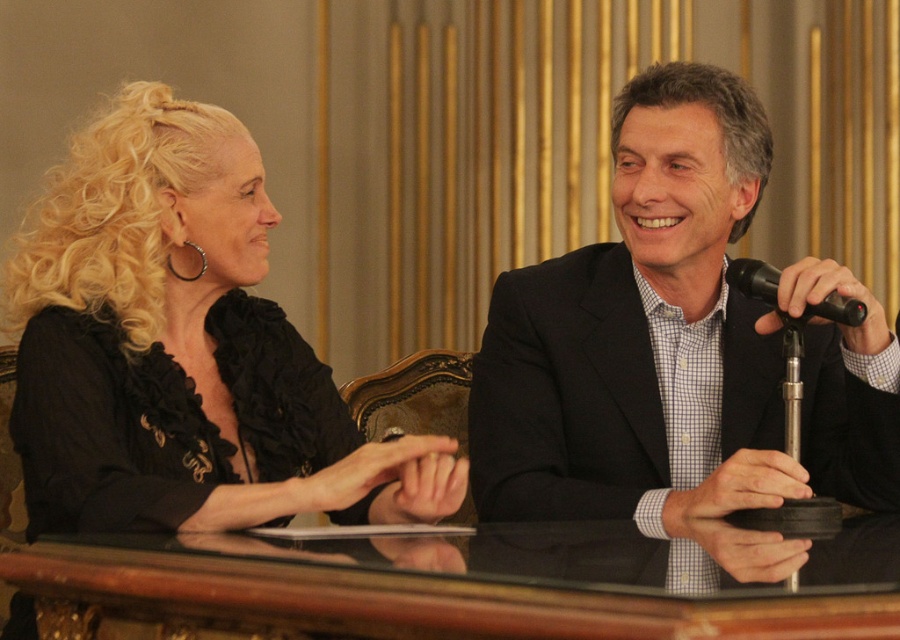
Question: Is black matte suit at center further to camera compared to black plastic microphone at right?

Choices:
 (A) yes
 (B) no

Answer: (B)

Question: Does black matte suit at center have a greater width compared to black satin blouse at left?

Choices:
 (A) yes
 (B) no

Answer: (B)

Question: Does black satin blouse at left appear under transparent glass table at center?

Choices:
 (A) no
 (B) yes

Answer: (A)

Question: Which point is closer to the camera taking this photo?

Choices:
 (A) (133, 552)
 (B) (896, 458)

Answer: (A)

Question: Which object appears farthest from the camera in this image?

Choices:
 (A) black plastic microphone at right
 (B) black matte suit at center

Answer: (A)

Question: Which object is positioned farthest from the black plastic microphone at right?

Choices:
 (A) transparent glass table at center
 (B) black satin blouse at left
 (C) black matte suit at center

Answer: (B)